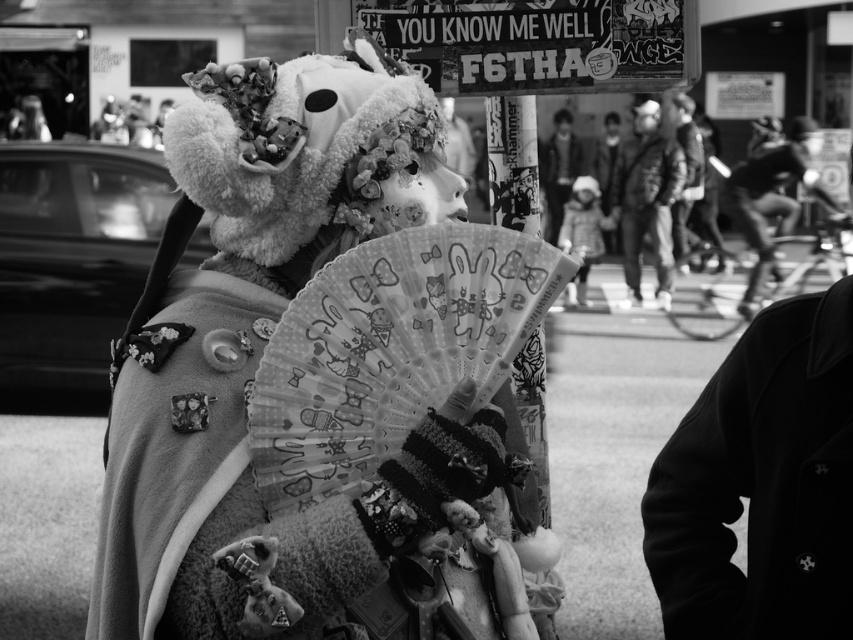
Looking at this image, you are a photographer trying to capture the entire fluffy white teddy bear at center and dark gray jacket at center in one frame. Which object should you focus on to ensure both are fully visible?

Since the fluffy white teddy bear at center is wider than the dark gray jacket at center, you should focus on the fluffy white teddy bear at center to ensure both objects are fully visible in the frame.

You are a photographer trying to capture the teddy bear headpiece and the jacket in the same frame. Since the fluffy white teddy bear at center and the dark gray jacket at center are both at the center, which one will appear larger in your photo?

The fluffy white teddy bear at center is closer to the viewer than the dark gray jacket at center, so it will appear larger in the photo.

You are organizing a costume party and need to store the costume from the image. The storage space available is just enough for items that take up the same amount of space as the fluffy white teddy bear at center. Can the dark gray jacket at center fit into this space?

The fluffy white teddy bear at center occupies less space than the dark gray jacket at center, so the dark gray jacket at center cannot fit into the storage space allocated for the fluffy white teddy bear at center.